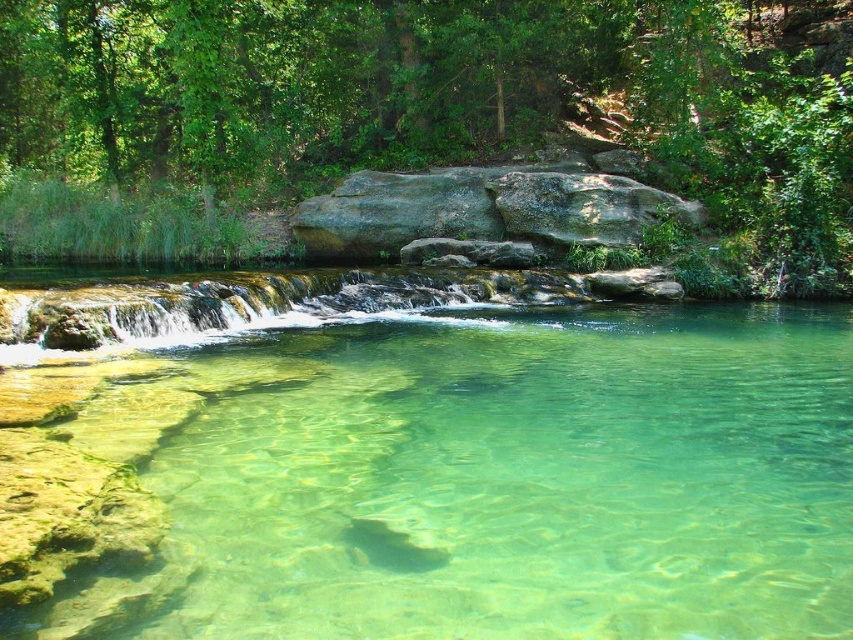
Which is below, clear glassy stream at center or green leafy tree at upper center?

clear glassy stream at center is below.

Is clear glassy stream at center further to the viewer compared to green leafy tree at upper center?

No, clear glassy stream at center is closer to the viewer.

Between point (329, 275) and point (271, 131), which one is positioned in front?

Point (329, 275)

I want to click on clear glassy stream at center, so click(430, 468).